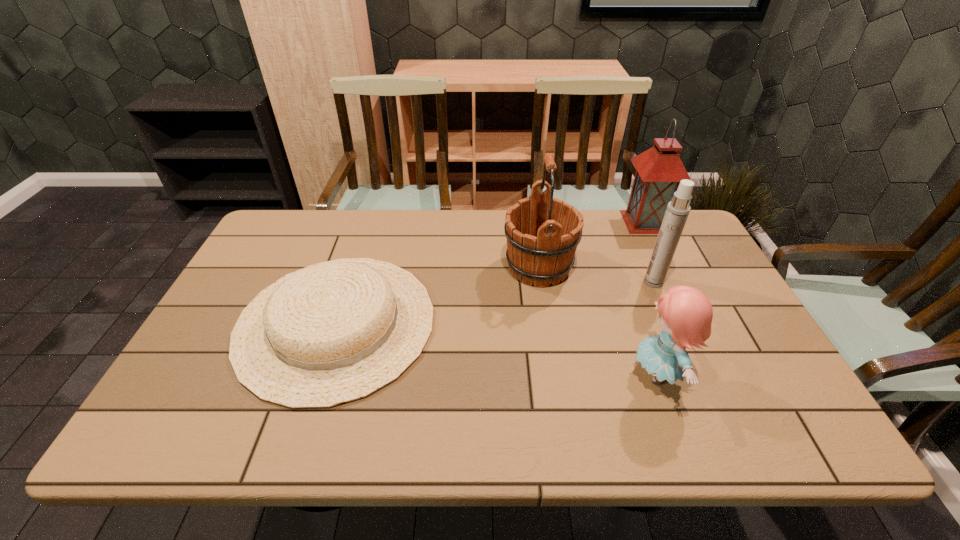
Find the location of `object at the far right corner`. object at the far right corner is located at coordinates (659, 170).

I want to click on vacant space at the far edge, so click(446, 242).

Where is `free region at the near edge of the desktop`? free region at the near edge of the desktop is located at coordinates (279, 443).

Where is `free region at the left edge`? The image size is (960, 540). free region at the left edge is located at coordinates (286, 261).

In the image, there is a desktop. Where is `vacant region at the far left corner`? vacant region at the far left corner is located at coordinates (294, 239).

This screenshot has height=540, width=960. In the image, there is a desktop. Find the location of `vacant space at the near left corner`. vacant space at the near left corner is located at coordinates tap(157, 436).

Locate an element on the screen. This screenshot has height=540, width=960. blank area at the near right corner is located at coordinates (784, 415).

At what (x,y) coordinates should I click in order to perform the action: click on blank region between the lantern and the aerosol can. Please return your answer as a coordinate pair (x, y). The image size is (960, 540). Looking at the image, I should click on (649, 252).

This screenshot has height=540, width=960. Find the location of `vacant area between the fourth tallest object and the lantern`. vacant area between the fourth tallest object and the lantern is located at coordinates pos(651,298).

In order to click on free point between the leftmost object and the aerosol can in this screenshot , I will do `click(494, 302)`.